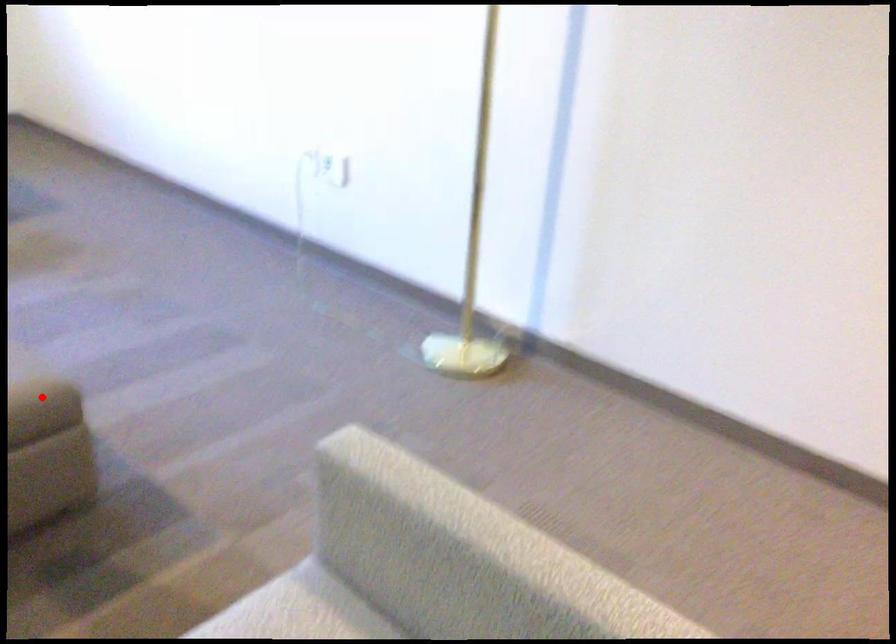
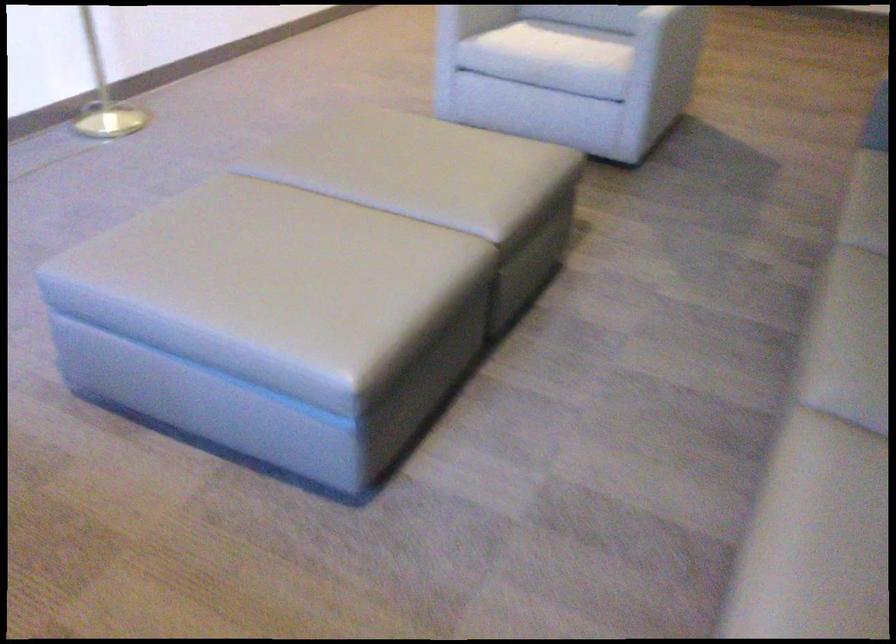
Question: I am providing you with two images of the same scene from different viewpoints. A red point is marked on the first image. At the location where the point appears in image 1, is it still visible in image 2?

Choices:
 (A) Yes
 (B) No

Answer: (B)